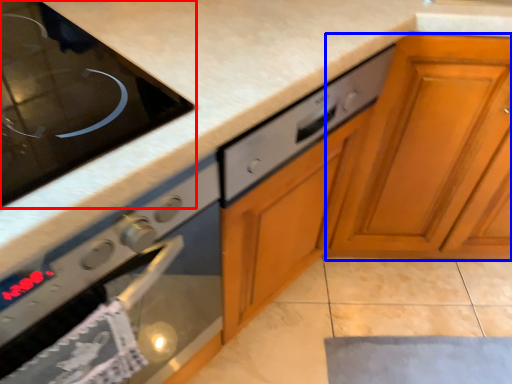
Question: Which of the following is the farthest to the observer, home appliance (highlighted by a red box) or cabinetry (highlighted by a blue box)?

Choices:
 (A) home appliance
 (B) cabinetry

Answer: (B)